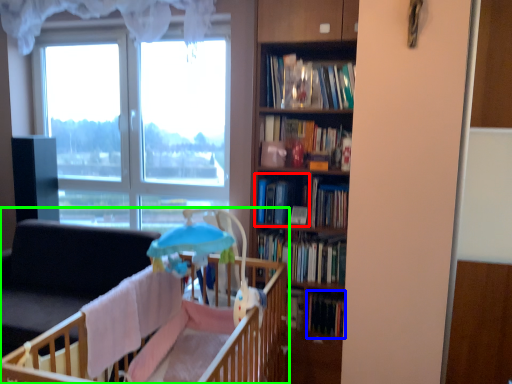
Question: Which is farther away from book (highlighted by a red box)? book (highlighted by a blue box) or infant bed (highlighted by a green box)?

Choices:
 (A) book
 (B) infant bed

Answer: (A)